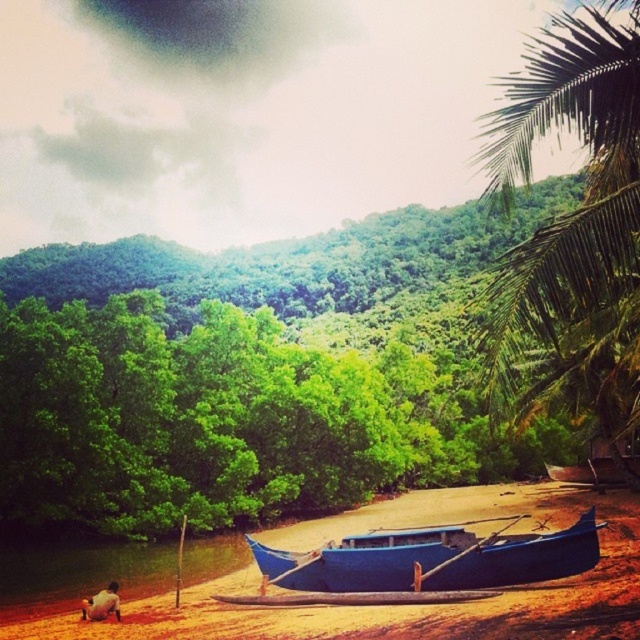
Does blue polished wood boat at center appear on the right side of blue wooden canoe at center?

In fact, blue polished wood boat at center is to the left of blue wooden canoe at center.

The image size is (640, 640). Describe the element at coordinates (433, 557) in the screenshot. I see `blue polished wood boat at center` at that location.

Find the location of `blue polished wood boat at center`. blue polished wood boat at center is located at coordinates (433, 557).

Is point (285, 602) closer to camera compared to point (109, 604)?

No.

What do you see at coordinates (355, 596) in the screenshot? I see `blue wooden canoe at center` at bounding box center [355, 596].

This screenshot has width=640, height=640. Find the location of `blue wooden canoe at center`. blue wooden canoe at center is located at coordinates tap(355, 596).

Where is `blue wooden canoe at center`? The width and height of the screenshot is (640, 640). blue wooden canoe at center is located at coordinates (355, 596).

Is blue wooden boat at lower center further to the viewer compared to blue wooden canoe at center?

No, it is in front of blue wooden canoe at center.

Who is more forward, (515, 614) or (451, 589)?

Positioned in front is point (515, 614).

Is point (634, 516) positioned in front of point (353, 593)?

No.

Locate an element on the screen. blue wooden boat at lower center is located at coordinates (376, 605).